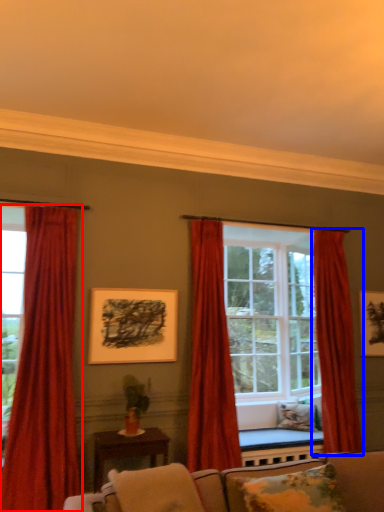
Question: Among these objects, which one is nearest to the camera, curtain (highlighted by a red box) or curtain (highlighted by a blue box)?

Choices:
 (A) curtain
 (B) curtain

Answer: (A)